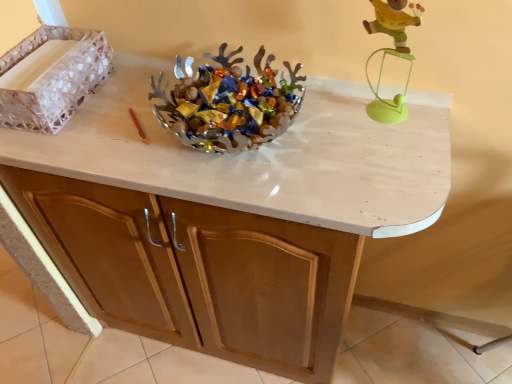
Question: From the image's perspective, is metallic silver bowl at center positioned above or below wooden figure at upper right?

Choices:
 (A) above
 (B) below

Answer: (B)

Question: Is metallic silver bowl at center wider or thinner than wooden figure at upper right?

Choices:
 (A) thin
 (B) wide

Answer: (B)

Question: Which object is the farthest from the metallic silver bowl at center?

Choices:
 (A) matte wood cabinet at center
 (B) wooden figure at upper right
 (C) white textured tray at left

Answer: (A)

Question: Considering the real-world distances, which object is farthest from the white textured tray at left?

Choices:
 (A) metallic silver bowl at center
 (B) wooden figure at upper right
 (C) matte wood cabinet at center

Answer: (B)